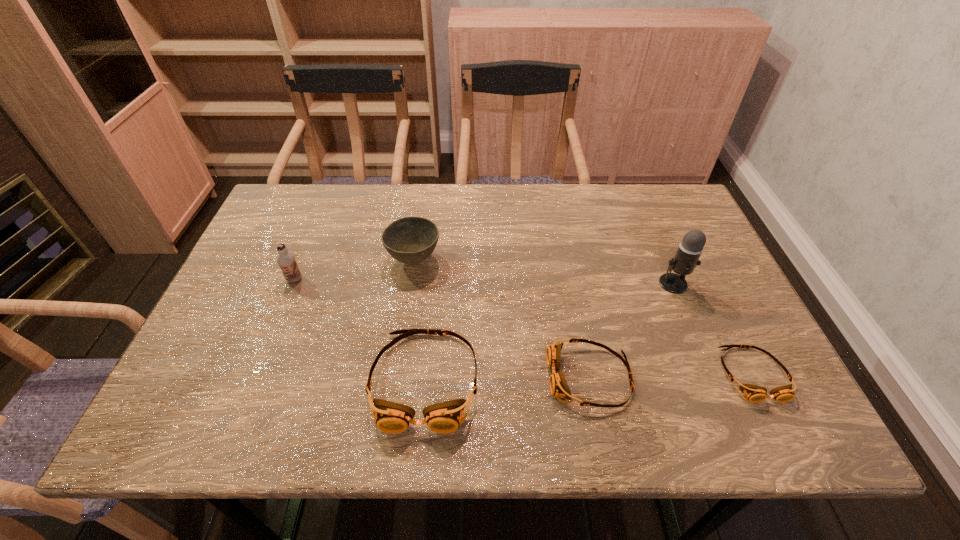
You are a GUI agent. You are given a task and a screenshot of the screen. Output one action in this format:
    pyautogui.click(x=<x>, y=<y>)
    Task: Click on the tallest goggles
    This screenshot has height=540, width=960.
    Given the screenshot: What is the action you would take?
    pyautogui.click(x=445, y=417)

The image size is (960, 540). In order to click on the leftmost goggles in this screenshot , I will do `click(445, 417)`.

You are a GUI agent. You are given a task and a screenshot of the screen. Output one action in this format:
    pyautogui.click(x=<x>, y=<y>)
    Task: Click on the fourth object from left to right
    This screenshot has width=960, height=540.
    Given the screenshot: What is the action you would take?
    pyautogui.click(x=559, y=388)

Locate an element on the screen. The height and width of the screenshot is (540, 960). the second shortest object is located at coordinates (559, 388).

You are a GUI agent. You are given a task and a screenshot of the screen. Output one action in this format:
    pyautogui.click(x=<x>, y=<y>)
    Task: Click on the rightmost goggles
    This screenshot has width=960, height=540.
    Given the screenshot: What is the action you would take?
    pyautogui.click(x=754, y=393)

What are the coordinates of `the shortest object` in the screenshot? It's located at (754, 393).

The height and width of the screenshot is (540, 960). Identify the location of the tallest object. (689, 251).

The height and width of the screenshot is (540, 960). Identify the location of bowl. (410, 240).

Identify the location of the leftmost object. The height and width of the screenshot is (540, 960). (286, 260).

Find the location of a particular element. Image resolution: width=960 pixels, height=540 pixels. the second tallest object is located at coordinates (286, 260).